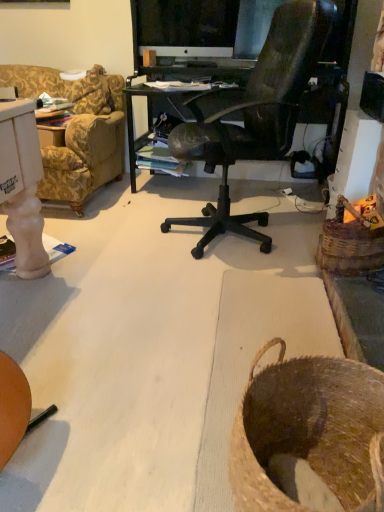
I want to click on white glossy computer monitor at upper center, so click(184, 28).

Describe the element at coordinates (307, 429) in the screenshot. I see `brown woven basket at lower right, the second basket from the back` at that location.

Find the location of a particular element. Image resolution: width=384 pixels, height=512 pixels. white glossy computer monitor at upper center is located at coordinates (184, 28).

Does woven brown basket at right, the 1th basket from the top, touch white glossy computer monitor at upper center?

There is a gap between woven brown basket at right, the 1th basket from the top, and white glossy computer monitor at upper center.

Which object is closer to the camera taking this photo, woven brown basket at right, the 1th basket from the top, or white glossy computer monitor at upper center?

Positioned in front is woven brown basket at right, the 1th basket from the top.

From a real-world perspective, which basket is the 1st one underneath the white glossy computer monitor at upper center? Please provide its 2D coordinates.

[(352, 240)]

Could you tell me if woven brown basket at right, which is counted as the second basket, starting from the left, is turned towards white glossy computer monitor at upper center?

No, woven brown basket at right, which is counted as the second basket, starting from the left, is not turned towards white glossy computer monitor at upper center.

How distant is brown woven basket at lower right, which is the 1th basket in left-to-right order, from white glossy computer monitor at upper center?

brown woven basket at lower right, which is the 1th basket in left-to-right order, is 2.59 meters away from white glossy computer monitor at upper center.

Is brown woven basket at lower right, acting as the 2th basket starting from the top, facing towards white glossy computer monitor at upper center?

No.

Is brown woven basket at lower right, marked as the 1th basket in a bottom-to-top arrangement, situated inside white glossy computer monitor at upper center or outside?

brown woven basket at lower right, marked as the 1th basket in a bottom-to-top arrangement, is not enclosed by white glossy computer monitor at upper center.

From the picture: Is woven brown basket at right, positioned as the 2th basket in bottom-to-top order, at the back of brown woven basket at lower right, acting as the 2th basket starting from the top?

brown woven basket at lower right, acting as the 2th basket starting from the top, is not turned away from woven brown basket at right, positioned as the 2th basket in bottom-to-top order.

At what (x,y) coordinates should I click in order to perform the action: click on basket behind the brown woven basket at lower right, which is the 1th basket in left-to-right order. Please return your answer as a coordinate pair (x, y). The height and width of the screenshot is (512, 384). Looking at the image, I should click on (352, 240).

From a real-world perspective, which is physically above, brown woven basket at lower right, acting as the 2th basket starting from the top, or woven brown basket at right, positioned as the 2th basket in bottom-to-top order?

woven brown basket at right, positioned as the 2th basket in bottom-to-top order, from a real-world perspective.

Does woven brown basket at right, which is counted as the second basket, starting from the left, have a smaller size compared to brown woven basket at lower right, acting as the 1th basket starting from the front?

Correct, woven brown basket at right, which is counted as the second basket, starting from the left, occupies less space than brown woven basket at lower right, acting as the 1th basket starting from the front.

From the image's perspective, which one is positioned higher, woven brown basket at right, the 1th basket from the top, or brown woven basket at lower right, acting as the 2th basket starting from the top?

woven brown basket at right, the 1th basket from the top, appears higher in the image.

Does woven brown basket at right, the first basket viewed from the back, lie in front of brown woven basket at lower right, marked as the 1th basket in a bottom-to-top arrangement?

No, woven brown basket at right, the first basket viewed from the back, is further to the viewer.

Are woven brown basket at right, which is counted as the first basket, starting from the right, and brown woven basket at lower right, acting as the 1th basket starting from the front, making contact?

woven brown basket at right, which is counted as the first basket, starting from the right, is not next to brown woven basket at lower right, acting as the 1th basket starting from the front, and they're not touching.

From a real-world perspective, is white glossy computer monitor at upper center physically above woven brown basket at right, the 1th basket from the top?

Yes.

Is white glossy computer monitor at upper center further to camera compared to woven brown basket at right, which is counted as the second basket, starting from the left?

Yes, it is.

Locate an element on the screen. computer monitor that appears above the woven brown basket at right, which appears as the 2th basket when viewed from the front (from the image's perspective) is located at coordinates (184, 28).

From the image's perspective, relative to brown woven basket at lower right, acting as the 1th basket starting from the front, is white glossy computer monitor at upper center above or below?

white glossy computer monitor at upper center is above brown woven basket at lower right, acting as the 1th basket starting from the front.

Can you confirm if white glossy computer monitor at upper center is bigger than brown woven basket at lower right, which is the 1th basket in left-to-right order?

No.

Which is behind, point (226, 10) or point (359, 461)?

The point (226, 10) is farther from the camera.

Find the location of a particular element. computer monitor above the woven brown basket at right, which appears as the 2th basket when viewed from the front (from a real-world perspective) is located at coordinates tap(184, 28).

Identify the location of computer monitor above the brown woven basket at lower right, acting as the 2th basket starting from the top (from the image's perspective). (184, 28).

From the picture: Looking at the image, which one is located closer to brown woven basket at lower right, acting as the 2th basket starting from the top, white glossy computer monitor at upper center or woven brown basket at right, positioned as the 2th basket in bottom-to-top order?

Among the two, woven brown basket at right, positioned as the 2th basket in bottom-to-top order, is located nearer to brown woven basket at lower right, acting as the 2th basket starting from the top.

Consider the image. Based on their spatial positions, is brown woven basket at lower right, the second basket from the back, or woven brown basket at right, the first basket viewed from the back, closer to white glossy computer monitor at upper center?

woven brown basket at right, the first basket viewed from the back, is positioned closer to the anchor white glossy computer monitor at upper center.

Looking at the image, which one is located further to brown woven basket at lower right, acting as the 2th basket starting from the top, woven brown basket at right, which is counted as the first basket, starting from the right, or white glossy computer monitor at upper center?

white glossy computer monitor at upper center is further to brown woven basket at lower right, acting as the 2th basket starting from the top.

Considering their positions, is brown woven basket at lower right, which is the 1th basket in left-to-right order, positioned further to woven brown basket at right, which is counted as the second basket, starting from the left, than white glossy computer monitor at upper center?

white glossy computer monitor at upper center is further to woven brown basket at right, which is counted as the second basket, starting from the left.

In the scene shown: Looking at the image, which one is located closer to white glossy computer monitor at upper center, woven brown basket at right, the first basket viewed from the back, or brown woven basket at lower right, the second basket from the back?

Among the two, woven brown basket at right, the first basket viewed from the back, is located nearer to white glossy computer monitor at upper center.

Based on their spatial positions, is white glossy computer monitor at upper center or brown woven basket at lower right, the 2th basket in the right-to-left sequence, further from woven brown basket at right, which is counted as the first basket, starting from the right?

white glossy computer monitor at upper center is positioned further to the anchor woven brown basket at right, which is counted as the first basket, starting from the right.

This screenshot has height=512, width=384. Find the location of `basket between brown woven basket at lower right, acting as the 2th basket starting from the top, and white glossy computer monitor at upper center in the front-back direction`. basket between brown woven basket at lower right, acting as the 2th basket starting from the top, and white glossy computer monitor at upper center in the front-back direction is located at coordinates tap(352, 240).